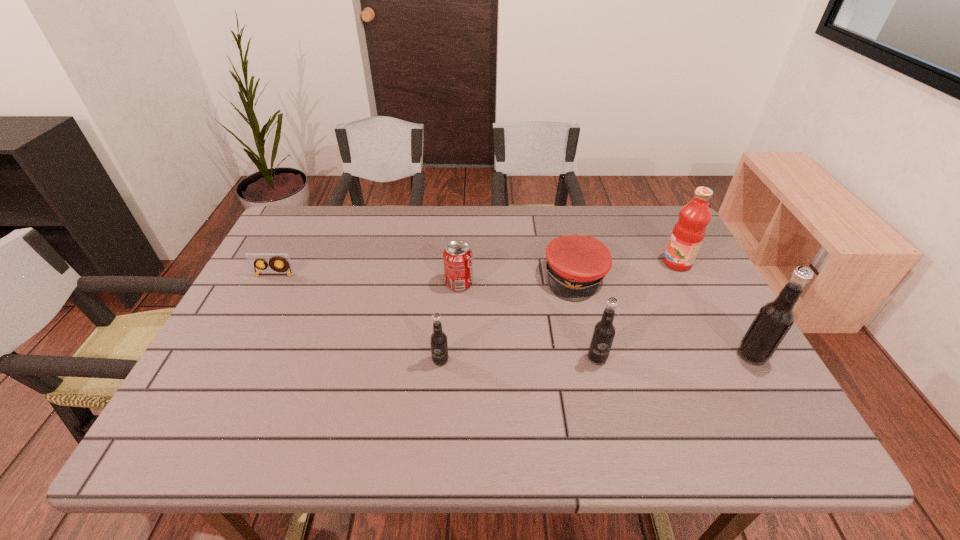
The root beers are evenly distributed in the image. To maintain this, where would you place another root beer on the left? Please point to a free space. Please provide its 2D coordinates. Your answer should be formatted as a tuple, i.e. [(x, y)], where the tuple contains the x and y coordinates of a point satisfying the conditions above.

[(282, 363)]